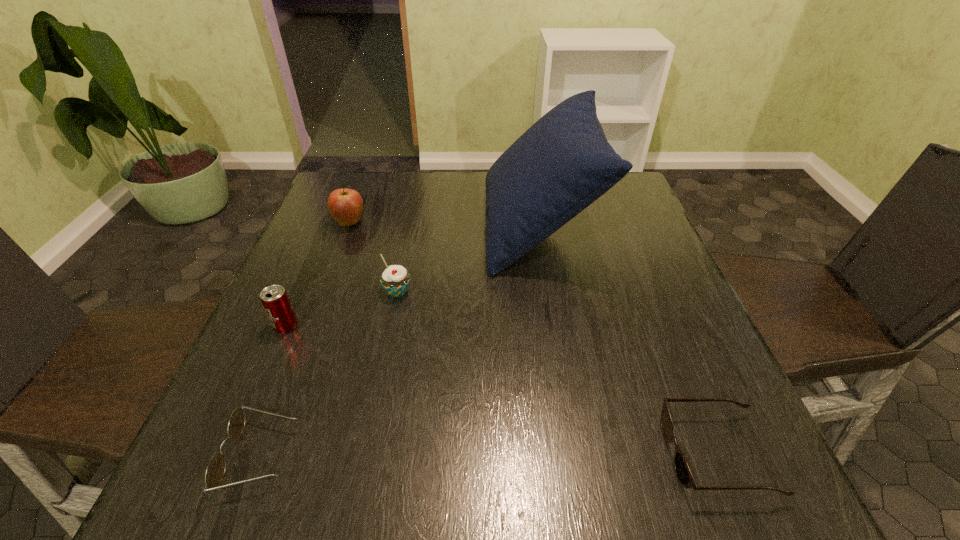
Identify the location of spectacles that is positioned at the near edge. (215, 471).

Find the location of a particular element. Image resolution: width=960 pixels, height=540 pixels. sunglasses that is positioned at the near edge is located at coordinates (683, 472).

At what (x,y) coordinates should I click in order to perform the action: click on apple at the left edge. Please return your answer as a coordinate pair (x, y). Looking at the image, I should click on (345, 205).

In order to click on beer can present at the left edge in this screenshot , I will do `click(274, 299)`.

This screenshot has width=960, height=540. I want to click on spectacles that is at the left edge, so click(215, 471).

At what (x,y) coordinates should I click in order to perform the action: click on cushion located at the right edge. Please return your answer as a coordinate pair (x, y). The width and height of the screenshot is (960, 540). Looking at the image, I should click on (563, 163).

I want to click on sunglasses that is at the right edge, so click(x=683, y=472).

What are the coordinates of `object situated at the far left corner` in the screenshot? It's located at (345, 205).

Image resolution: width=960 pixels, height=540 pixels. In order to click on object present at the near left corner in this screenshot , I will do `click(215, 471)`.

Where is `object situated at the far right corner`? This screenshot has height=540, width=960. object situated at the far right corner is located at coordinates (563, 163).